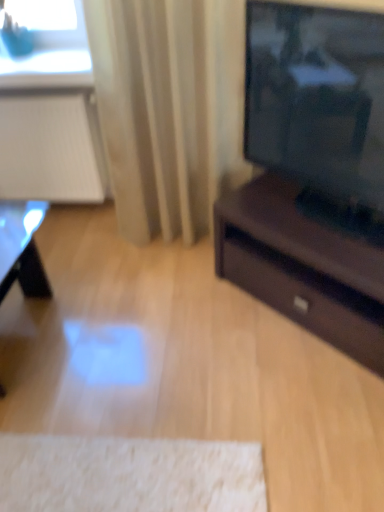
Question: Considering the relative sizes of shiny black table at lower left and beige fabric curtain at center in the image provided, is shiny black table at lower left shorter than beige fabric curtain at center?

Choices:
 (A) no
 (B) yes

Answer: (B)

Question: Does shiny black table at lower left have a smaller size compared to beige fabric curtain at center?

Choices:
 (A) yes
 (B) no

Answer: (A)

Question: Does shiny black table at lower left have a greater width compared to beige fabric curtain at center?

Choices:
 (A) no
 (B) yes

Answer: (B)

Question: Is shiny black table at lower left facing towards beige fabric curtain at center?

Choices:
 (A) no
 (B) yes

Answer: (A)

Question: Considering the relative positions of shiny black table at lower left and beige fabric curtain at center in the image provided, is shiny black table at lower left to the left of beige fabric curtain at center from the viewer's perspective?

Choices:
 (A) no
 (B) yes

Answer: (B)

Question: In terms of width, does blue matte glass at upper left look wider or thinner when compared to shiny black table at lower left?

Choices:
 (A) wide
 (B) thin

Answer: (B)

Question: Based on their positions, is blue matte glass at upper left located to the left or right of shiny black table at lower left?

Choices:
 (A) right
 (B) left

Answer: (B)

Question: Is point (79, 28) closer or farther from the camera than point (19, 266)?

Choices:
 (A) farther
 (B) closer

Answer: (A)

Question: Is blue matte glass at upper left inside or outside of shiny black table at lower left?

Choices:
 (A) inside
 (B) outside

Answer: (B)

Question: Would you say beige fabric curtain at center is inside or outside blue matte glass at upper left?

Choices:
 (A) inside
 (B) outside

Answer: (B)

Question: Looking at the image, does beige fabric curtain at center seem bigger or smaller compared to blue matte glass at upper left?

Choices:
 (A) big
 (B) small

Answer: (A)

Question: From a real-world perspective, is beige fabric curtain at center above or below blue matte glass at upper left?

Choices:
 (A) below
 (B) above

Answer: (A)

Question: Considering the positions of beige fabric curtain at center and blue matte glass at upper left in the image, is beige fabric curtain at center taller or shorter than blue matte glass at upper left?

Choices:
 (A) tall
 (B) short

Answer: (A)

Question: Is shiny black table at lower left wider or thinner than blue matte glass at upper left?

Choices:
 (A) wide
 (B) thin

Answer: (A)

Question: Is shiny black table at lower left taller or shorter than blue matte glass at upper left?

Choices:
 (A) short
 (B) tall

Answer: (B)